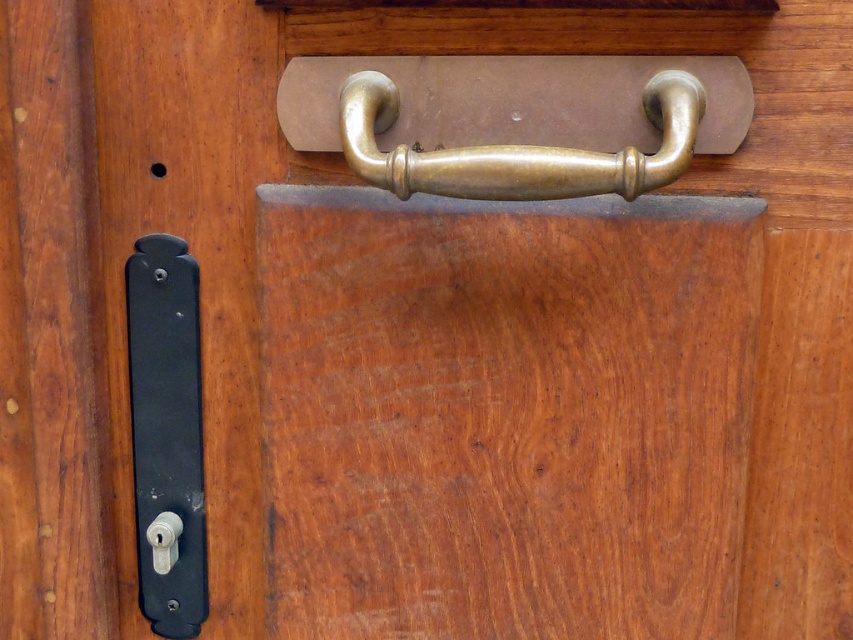
Question: From the image, what is the correct spatial relationship of black matte door handle at lower left in relation to brass/bronze handle at center?

Choices:
 (A) right
 (B) left

Answer: (B)

Question: Can you confirm if black matte door handle at lower left is positioned to the left of white plastic knob at lower left?

Choices:
 (A) no
 (B) yes

Answer: (B)

Question: Which object is the farthest from the white plastic knob at lower left?

Choices:
 (A) black matte door handle at lower left
 (B) brass/bronze handle at center

Answer: (B)

Question: Which point is farther to the camera?

Choices:
 (A) white plastic knob at lower left
 (B) brass/bronze handle at center
 (C) black matte door handle at lower left

Answer: (A)

Question: Does black matte door handle at lower left have a larger size compared to brass/bronze handle at center?

Choices:
 (A) no
 (B) yes

Answer: (A)

Question: Which object appears farthest from the camera in this image?

Choices:
 (A) white plastic knob at lower left
 (B) black matte door handle at lower left
 (C) brass/bronze handle at center

Answer: (A)